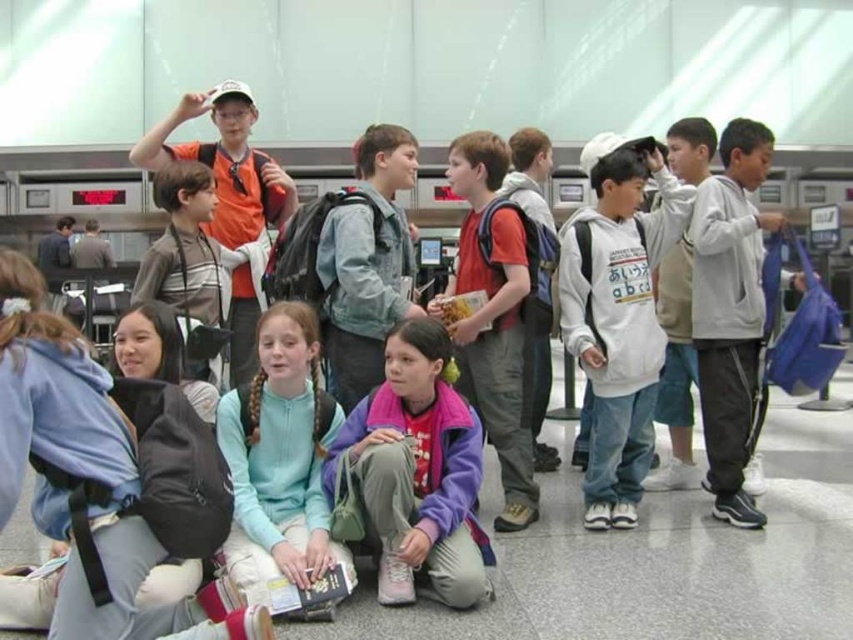
Question: Which of the following is the farthest from the observer?

Choices:
 (A) light blue fleece jacket at center
 (B) red matte backpack at center
 (C) white cotton hoodie at center

Answer: (B)

Question: Which object is farther from the camera taking this photo?

Choices:
 (A) light blue fleece jacket at center
 (B) white cotton hoodie at center
 (C) denim jacket at center
 (D) gray fleece hoodie at right

Answer: (B)

Question: Does light blue fleece jacket at center have a lesser width compared to denim jacket at center?

Choices:
 (A) yes
 (B) no

Answer: (B)

Question: Does gray fleece hoodie at right appear under red matte backpack at center?

Choices:
 (A) no
 (B) yes

Answer: (A)

Question: Does purple fleece jacket at center appear over red matte backpack at center?

Choices:
 (A) no
 (B) yes

Answer: (A)

Question: Which point is closer to the camera?

Choices:
 (A) (604, 362)
 (B) (332, 332)
 (C) (329, 566)
 (D) (723, 419)

Answer: (C)